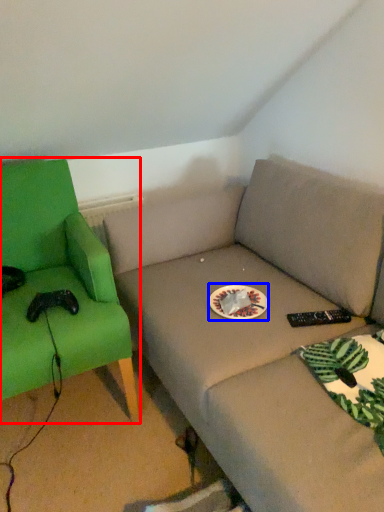
Question: Which object appears farthest to the camera in this image, chair (highlighted by a red box) or paper plate (highlighted by a blue box)?

Choices:
 (A) chair
 (B) paper plate

Answer: (B)